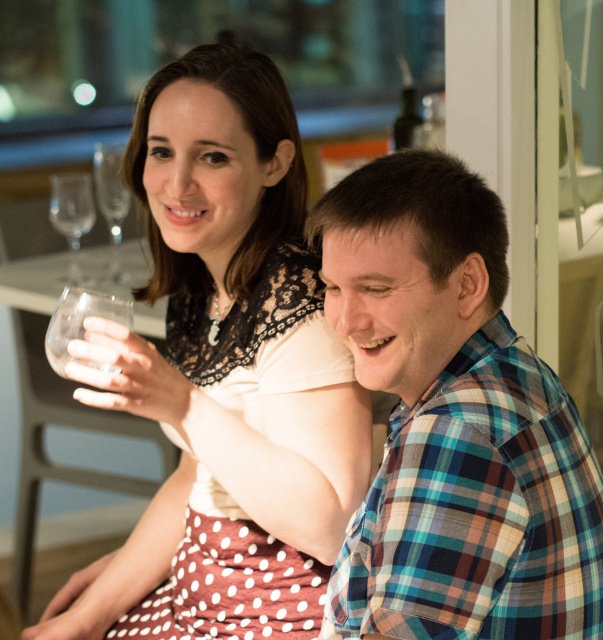
You are a photographer trying to capture a candid shot of both the white lace dress at upper center and the plaid cotton shirt at right. Based on their positions, which clothing item is positioned closer to the camera?

The white lace dress at upper center is positioned closer to the camera than the plaid cotton shirt at right.

You are a waiter in a restaurant and need to deliver a drink to the transparent glass at left. What is the exact coordinate where you should place the drink?

The transparent glass at left is located at point (72, 216), so you should place the drink there.

You are a waiter in a restaurant. You see two glasses on the table between the transparent glass at left and the clear glass wine glass at upper left. The customer wants to place a napkin between them. Is there enough space for the napkin?

The transparent glass at left and the clear glass wine glass at upper left are 4.64 inches apart from each other. Since a standard napkin is about 6 inches wide, there isn not enough space to place the napkin between them.